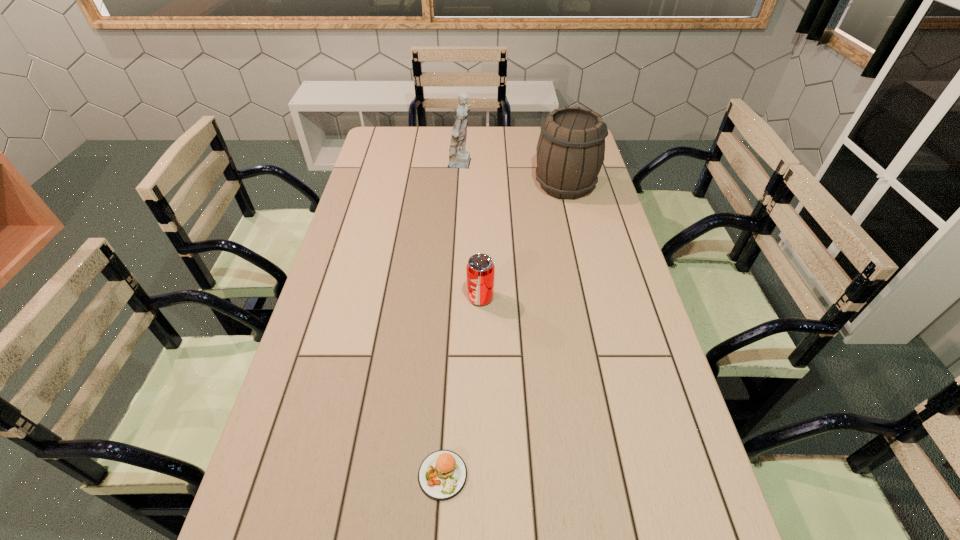
This screenshot has width=960, height=540. I want to click on free space that is in between the soda can and the figurine, so click(471, 231).

Identify the location of vacant space in between the second shortest object and the figurine. Image resolution: width=960 pixels, height=540 pixels. (471, 231).

Find the location of a particular element. The image size is (960, 540). empty location between the wine bucket and the figurine is located at coordinates (514, 175).

The height and width of the screenshot is (540, 960). What are the coordinates of `free area in between the figurine and the soda can` in the screenshot? It's located at (471, 231).

Select which object appears as the second closest to the wine bucket. Please provide its 2D coordinates. Your answer should be formatted as a tuple, i.e. [(x, y)], where the tuple contains the x and y coordinates of a point satisfying the conditions above.

[(480, 269)]

What are the coordinates of `object that is the closest to the patty` in the screenshot? It's located at (480, 269).

This screenshot has height=540, width=960. Find the location of `free space that satisfies the following two spatial constraints: 1. on the front-facing side of the wine bucket; 2. on the left side of the figurine`. free space that satisfies the following two spatial constraints: 1. on the front-facing side of the wine bucket; 2. on the left side of the figurine is located at coordinates (462, 185).

You are a GUI agent. You are given a task and a screenshot of the screen. Output one action in this format:
    pyautogui.click(x=<x>, y=<y>)
    Task: Click on the vacant space that satisfies the following two spatial constraints: 1. on the front-facing side of the figurine; 2. on the left side of the second shortest object
    
    Given the screenshot: What is the action you would take?
    pyautogui.click(x=456, y=298)

I want to click on free location that satisfies the following two spatial constraints: 1. on the back side of the rightmost object; 2. on the left side of the patty, so click(459, 185).

Image resolution: width=960 pixels, height=540 pixels. What are the coordinates of `vacant area that satisfies the following two spatial constraints: 1. on the front-facing side of the figurine; 2. on the right side of the wine bucket` in the screenshot? It's located at (462, 185).